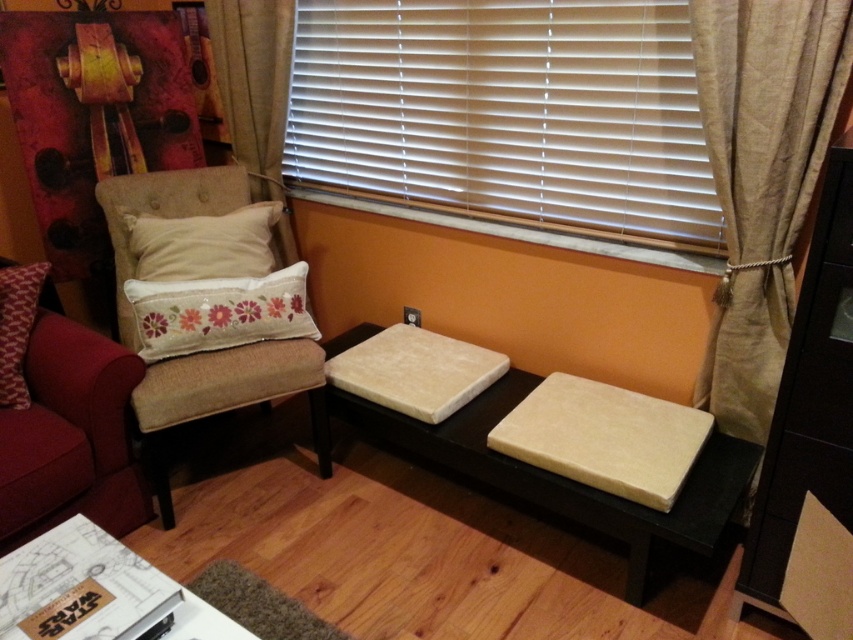
Question: Which point is closer to the camera?

Choices:
 (A) white plastic blinds at upper center
 (B) beige fabric curtain at upper center

Answer: (A)

Question: Does beige fabric armchair at left have a smaller size compared to beige fabric pillow at upper left?

Choices:
 (A) no
 (B) yes

Answer: (A)

Question: Does beige fabric stool at center appear on the left side of floral embroidered cushion at center?

Choices:
 (A) yes
 (B) no

Answer: (B)

Question: Which of these objects is positioned farthest from the white plastic blinds at upper center?

Choices:
 (A) red textured pillow at left
 (B) beige fabric stool at center
 (C) beige fabric armchair at left
 (D) beige fabric curtain at right

Answer: (A)

Question: Among these objects, which one is farthest from the camera?

Choices:
 (A) beige fabric curtain at upper center
 (B) red textured pillow at left

Answer: (A)

Question: Is the position of velvet red couch at left less distant than that of floral embroidered cushion at center?

Choices:
 (A) no
 (B) yes

Answer: (B)